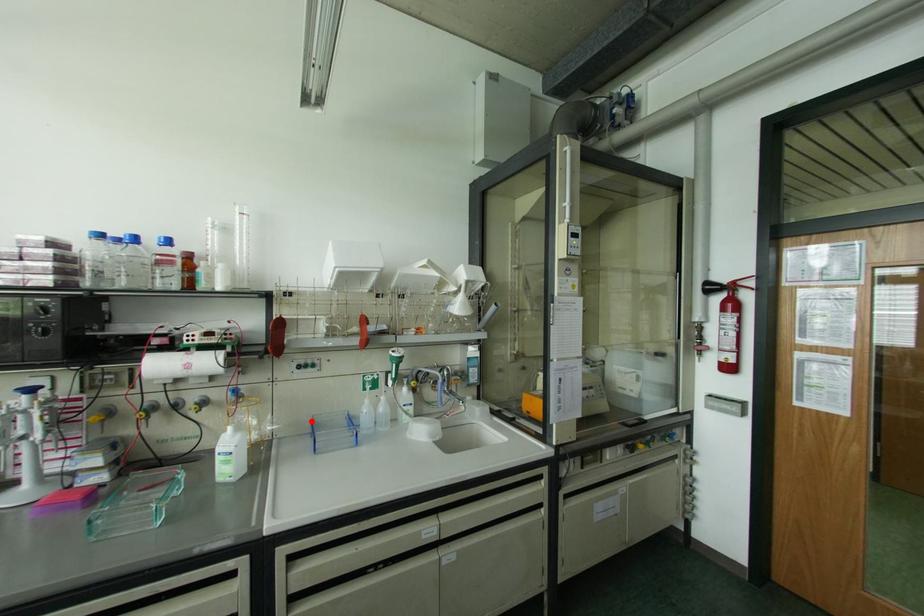
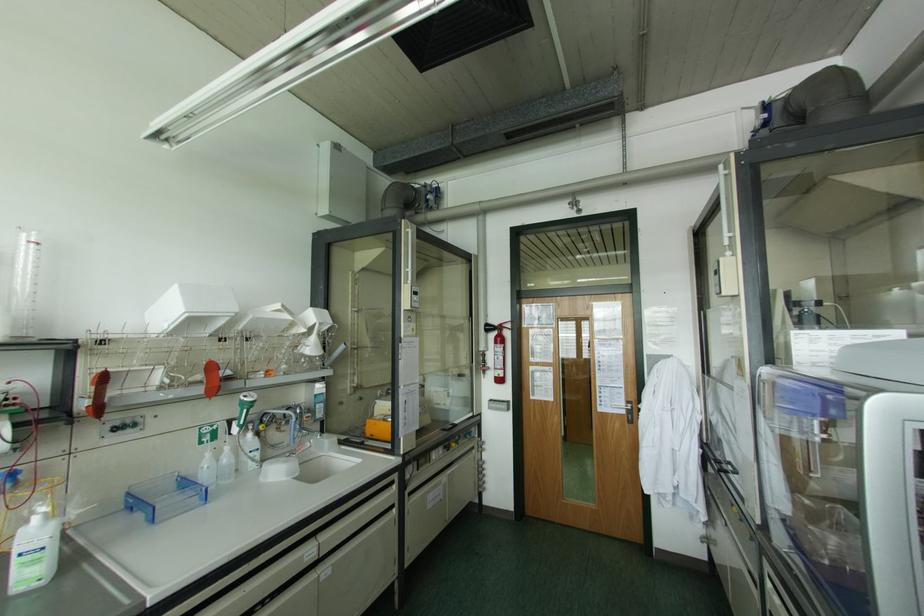
Find the pixel in the second image that matches the highlighted location in the first image.

(128, 493)